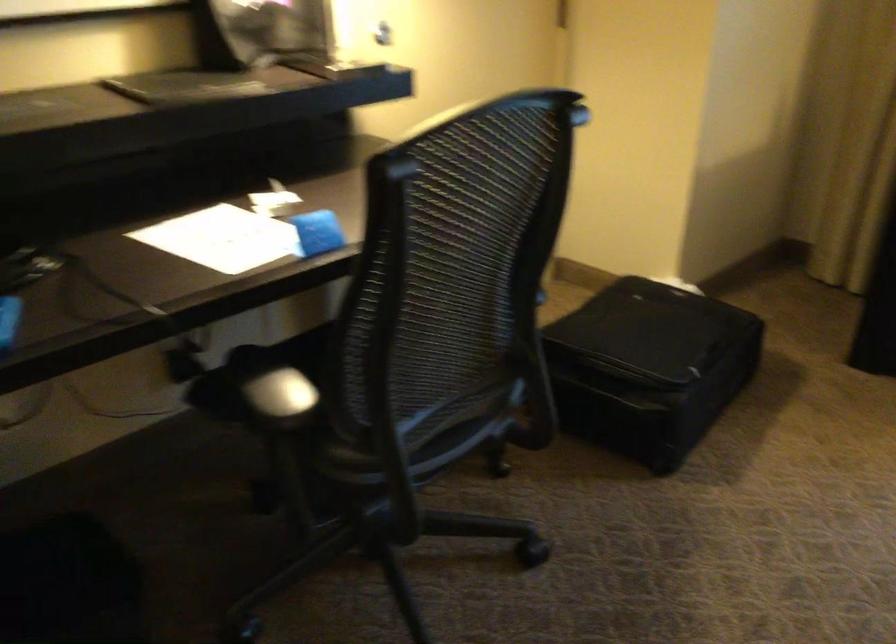
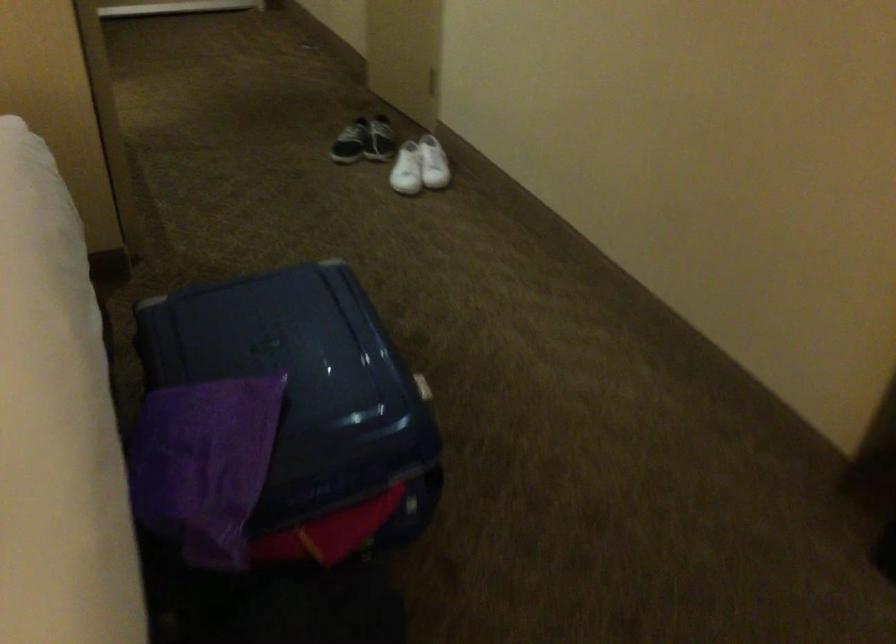
The first image is from the beginning of the video and the second image is from the end. How did the camera likely rotate when shooting the video?

The rotation direction of the camera is left-down.